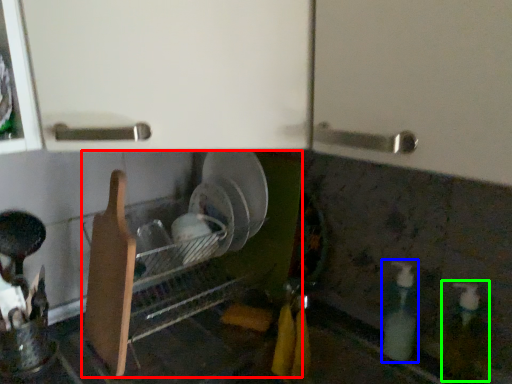
Question: Which object is the closest to the dish washer (highlighted by a red box)? Choose among these: bottle (highlighted by a blue box) or bottle (highlighted by a green box).

Choices:
 (A) bottle
 (B) bottle

Answer: (A)